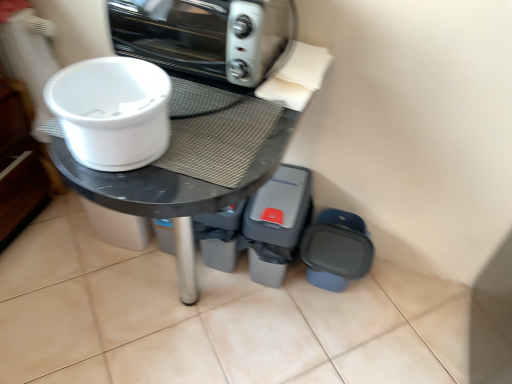
Locate an element on the screen. Image resolution: width=512 pixels, height=384 pixels. free region under matte black table at center (from a real-world perspective) is located at coordinates (186, 310).